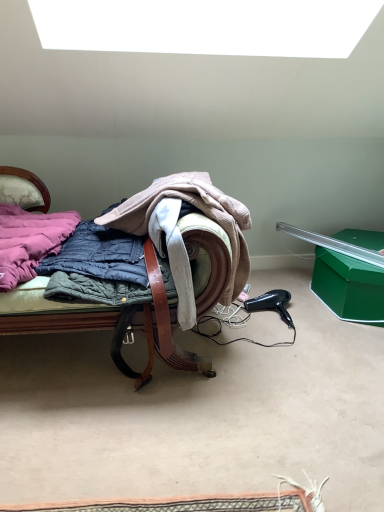
Find the location of a particular element. vacant point to the right of quilted fabric chair at center is located at coordinates (299, 364).